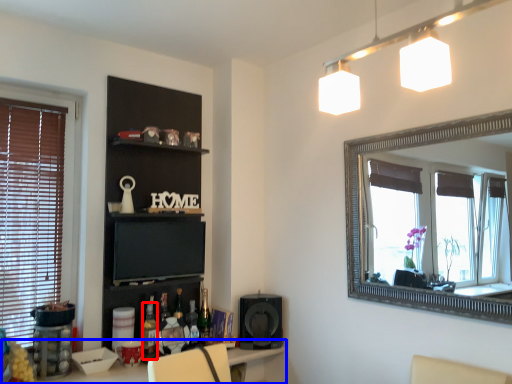
Question: Which of the following is the closest to the observer, bottle (highlighted by a red box) or table (highlighted by a blue box)?

Choices:
 (A) bottle
 (B) table

Answer: (B)